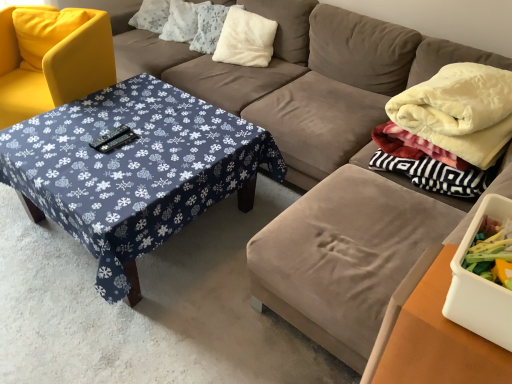
Question: Can you confirm if yellow fabric chair at left is positioned to the right of wooden table at lower right?

Choices:
 (A) yes
 (B) no

Answer: (B)

Question: Considering the relative sizes of yellow fabric chair at left and wooden table at lower right in the image provided, is yellow fabric chair at left smaller than wooden table at lower right?

Choices:
 (A) yes
 (B) no

Answer: (B)

Question: Does yellow fabric chair at left turn towards wooden table at lower right?

Choices:
 (A) yes
 (B) no

Answer: (B)

Question: Does yellow fabric chair at left have a greater height compared to wooden table at lower right?

Choices:
 (A) no
 (B) yes

Answer: (A)

Question: Is the position of yellow fabric chair at left more distant than that of wooden table at lower right?

Choices:
 (A) no
 (B) yes

Answer: (B)

Question: Is yellow fabric chair at left wider than wooden table at lower right?

Choices:
 (A) yes
 (B) no

Answer: (A)

Question: Can you confirm if wooden table at lower right is positioned to the right of white fluffy pillow at upper center, the third pillow viewed from the left?

Choices:
 (A) yes
 (B) no

Answer: (A)

Question: From a real-world perspective, is wooden table at lower right under white fluffy pillow at upper center, which is counted as the first pillow, starting from the right?

Choices:
 (A) no
 (B) yes

Answer: (B)

Question: Is wooden table at lower right at the left side of white fluffy pillow at upper center, the third pillow viewed from the left?

Choices:
 (A) yes
 (B) no

Answer: (B)

Question: Is wooden table at lower right positioned with its back to white fluffy pillow at upper center, the third pillow viewed from the left?

Choices:
 (A) no
 (B) yes

Answer: (A)

Question: Does wooden table at lower right have a larger size compared to white fluffy pillow at upper center, the third pillow viewed from the left?

Choices:
 (A) no
 (B) yes

Answer: (B)

Question: Is wooden table at lower right smaller than white fluffy pillow at upper center, which is counted as the first pillow, starting from the right?

Choices:
 (A) yes
 (B) no

Answer: (B)

Question: Is there a large distance between white fluffy pillow at center, arranged as the second pillow when viewed from the right, and white fluffy pillow at upper center, which is the 1th pillow from left to right?

Choices:
 (A) yes
 (B) no

Answer: (B)